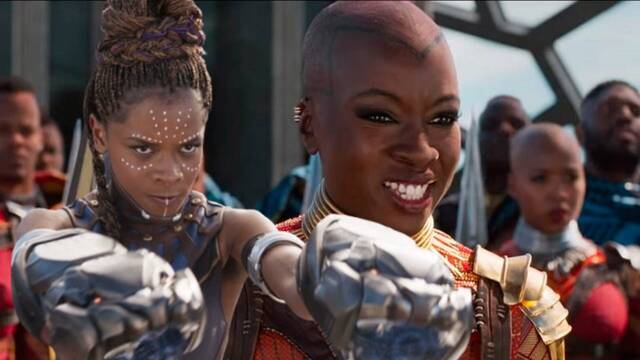
The image size is (640, 360). Find the location of `window`. window is located at coordinates (523, 73).